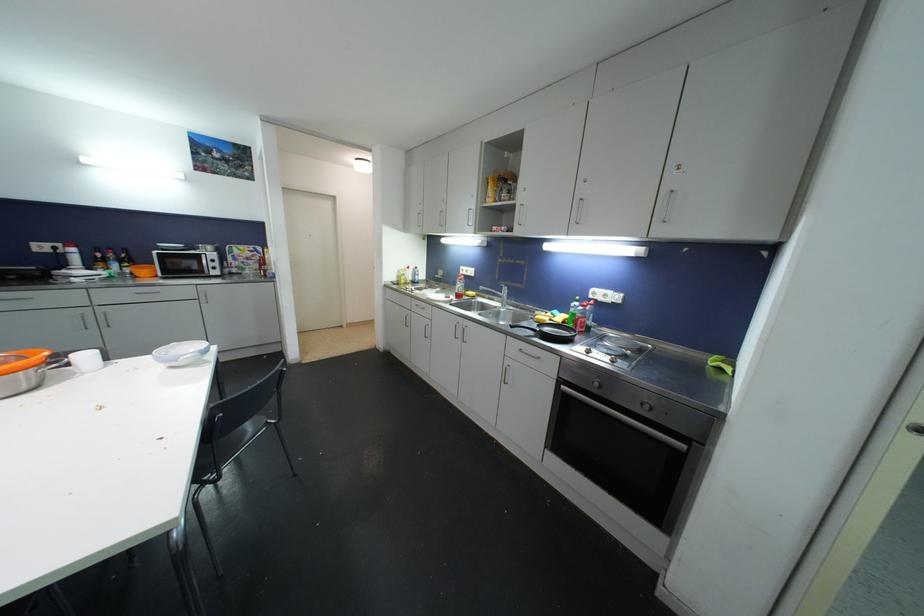
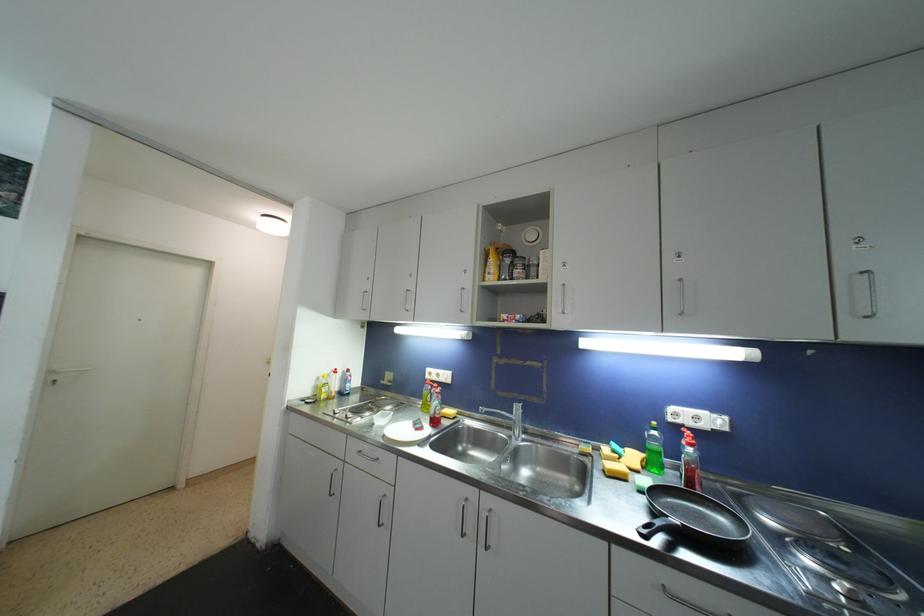
Where in the second image is the point corresponding to (579,306) from the first image?

(658, 436)